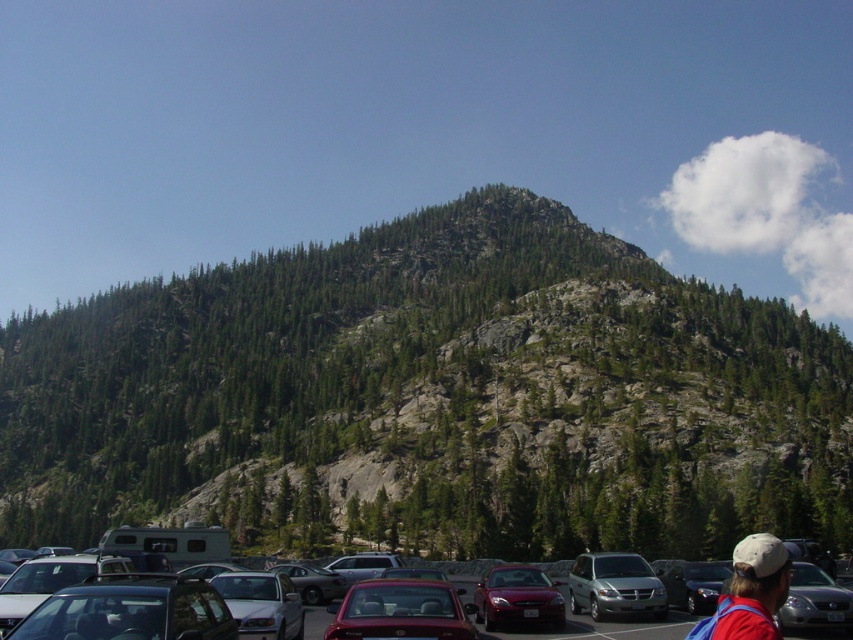
Is point (595, 593) closer to viewer compared to point (300, 609)?

No, (595, 593) is behind (300, 609).

Can you confirm if silver metallic minivan at lower center is positioned to the right of silver metallic sedan at center?

Indeed, silver metallic minivan at lower center is positioned on the right side of silver metallic sedan at center.

Which is in front, point (578, 600) or point (238, 592)?

Point (238, 592) is more forward.

At what (x,y) coordinates should I click in order to perform the action: click on silver metallic minivan at lower center. Please return your answer as a coordinate pair (x, y). Image resolution: width=853 pixels, height=640 pixels. Looking at the image, I should click on (614, 586).

Looking at this image, is green rocky mountain at center to the left of red shirt at lower right from the viewer's perspective?

Correct, you'll find green rocky mountain at center to the left of red shirt at lower right.

Between point (15, 410) and point (775, 632), which one is positioned in front?

Point (775, 632)

Identify the location of green rocky mountain at center. (432, 400).

This screenshot has width=853, height=640. Find the location of `green rocky mountain at center`. green rocky mountain at center is located at coordinates (432, 400).

Does silver metallic sedan at center have a lesser width compared to metallic silver sedan at lower right?

Yes.

What do you see at coordinates (260, 604) in the screenshot? The height and width of the screenshot is (640, 853). I see `silver metallic sedan at center` at bounding box center [260, 604].

Image resolution: width=853 pixels, height=640 pixels. Describe the element at coordinates (260, 604) in the screenshot. I see `silver metallic sedan at center` at that location.

You are a GUI agent. You are given a task and a screenshot of the screen. Output one action in this format:
    pyautogui.click(x=<x>, y=<y>)
    Task: Click on the silver metallic sedan at center
    The width and height of the screenshot is (853, 640).
    Given the screenshot: What is the action you would take?
    pyautogui.click(x=260, y=604)